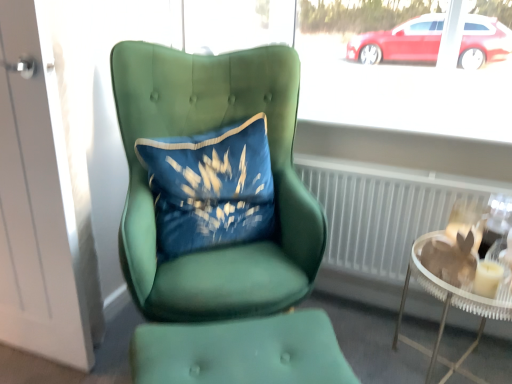
Question: Is green fabric footrest at lower center directly adjacent to white matte door at left?

Choices:
 (A) yes
 (B) no

Answer: (B)

Question: Would you say green fabric footrest at lower center is outside white matte door at left?

Choices:
 (A) no
 (B) yes

Answer: (B)

Question: Are green fabric footrest at lower center and white matte door at left located far from each other?

Choices:
 (A) yes
 (B) no

Answer: (B)

Question: Considering the relative positions of green fabric footrest at lower center and white matte door at left in the image provided, is green fabric footrest at lower center to the right of white matte door at left from the viewer's perspective?

Choices:
 (A) no
 (B) yes

Answer: (B)

Question: From a real-world perspective, does green fabric footrest at lower center sit lower than white matte door at left?

Choices:
 (A) no
 (B) yes

Answer: (B)

Question: Visually, is velvet green chair at center positioned to the left or to the right of translucent glass candle at right?

Choices:
 (A) right
 (B) left

Answer: (B)

Question: In terms of width, does velvet green chair at center look wider or thinner when compared to translucent glass candle at right?

Choices:
 (A) wide
 (B) thin

Answer: (A)

Question: Is velvet green chair at center taller or shorter than translucent glass candle at right?

Choices:
 (A) short
 (B) tall

Answer: (B)

Question: Is velvet green chair at center in front of or behind translucent glass candle at right in the image?

Choices:
 (A) behind
 (B) front

Answer: (B)

Question: From a real-world perspective, is white matte door at left above or below velvet blue pillow at center?

Choices:
 (A) above
 (B) below

Answer: (B)

Question: Does point (9, 13) appear closer or farther from the camera than point (161, 201)?

Choices:
 (A) closer
 (B) farther

Answer: (A)

Question: Considering the positions of white matte door at left and velvet blue pillow at center in the image, is white matte door at left wider or thinner than velvet blue pillow at center?

Choices:
 (A) thin
 (B) wide

Answer: (A)

Question: From the image's perspective, is white matte door at left located above or below velvet blue pillow at center?

Choices:
 (A) below
 (B) above

Answer: (A)

Question: Does point (411, 344) appear closer or farther from the camera than point (205, 367)?

Choices:
 (A) closer
 (B) farther

Answer: (B)

Question: In the image, is clear glass table at lower right positioned in front of or behind green fabric footrest at lower center?

Choices:
 (A) front
 (B) behind

Answer: (B)